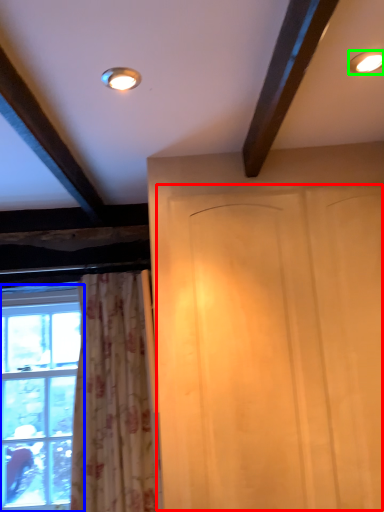
Question: Which is farther away from screen door (highlighted by a red box)? window (highlighted by a blue box) or lighting (highlighted by a green box)?

Choices:
 (A) window
 (B) lighting

Answer: (A)